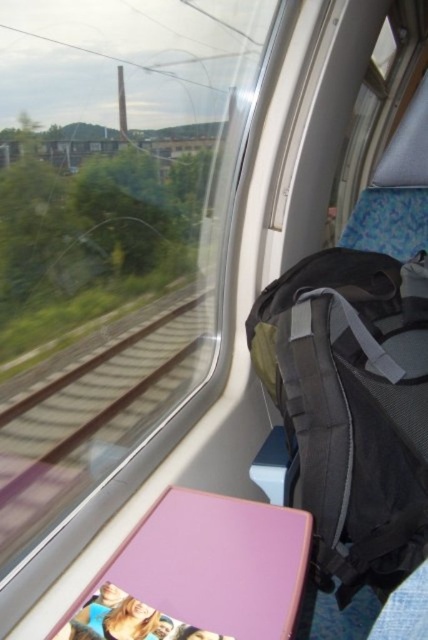
Does black fabric backpack at right appear on the left side of brown metal train track at left?

Incorrect, black fabric backpack at right is not on the left side of brown metal train track at left.

How distant is black fabric backpack at right from brown metal train track at left?

15.33 inches

Is point (419, 522) farther from viewer compared to point (0, 550)?

That is True.

Locate an element on the screen. The image size is (428, 640). black fabric backpack at right is located at coordinates (351, 406).